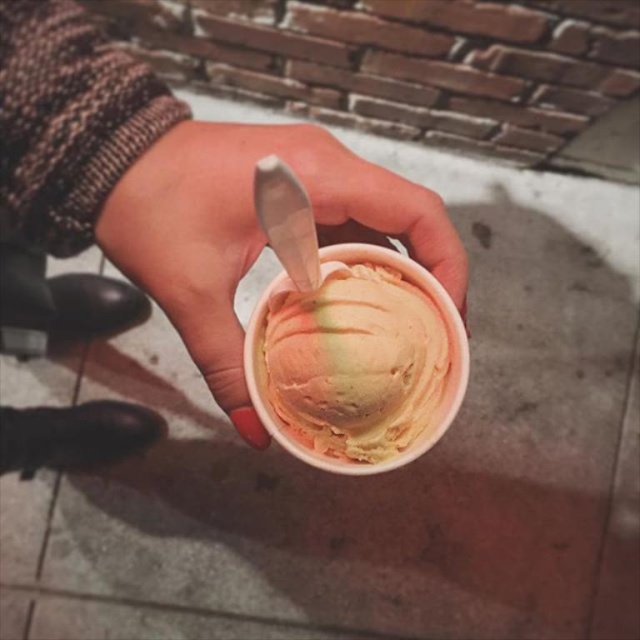
Is matte plastic cup at center positioned in front of pastel swirl ice cream at center?

No, matte plastic cup at center is further to the viewer.

Does matte plastic cup at center have a larger size compared to pastel swirl ice cream at center?

Indeed, matte plastic cup at center has a larger size compared to pastel swirl ice cream at center.

Does point (236, 188) come closer to viewer compared to point (422, 420)?

Yes, point (236, 188) is in front of point (422, 420).

Locate an element on the screen. This screenshot has height=640, width=640. matte plastic cup at center is located at coordinates (252, 230).